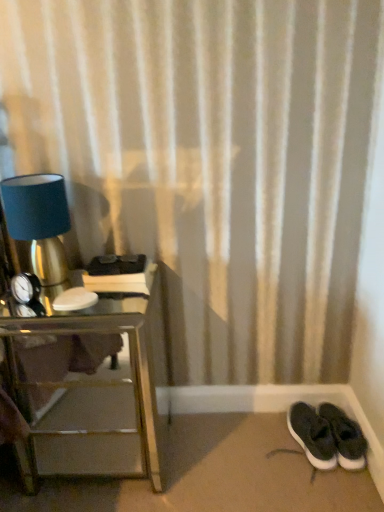
Where is `vacant area that lies between silver mirrored nightstand at left and black suede sneakers at lower right`? This screenshot has width=384, height=512. vacant area that lies between silver mirrored nightstand at left and black suede sneakers at lower right is located at coordinates (231, 452).